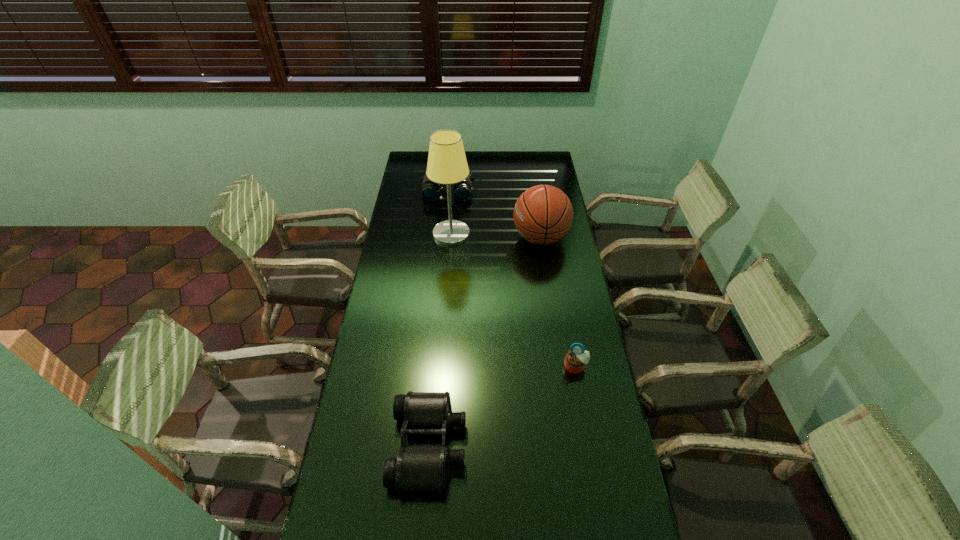
Find the location of `vacant area that satisfies the following two spatial constraints: 1. through the lenses of the tallest object; 2. on the right side of the taller binoculars`. vacant area that satisfies the following two spatial constraints: 1. through the lenses of the tallest object; 2. on the right side of the taller binoculars is located at coordinates (444, 234).

Locate an element on the screen. The width and height of the screenshot is (960, 540). free space that satisfies the following two spatial constraints: 1. on the front side of the table lamp; 2. through the eyepieces of the shorter binoculars is located at coordinates (436, 445).